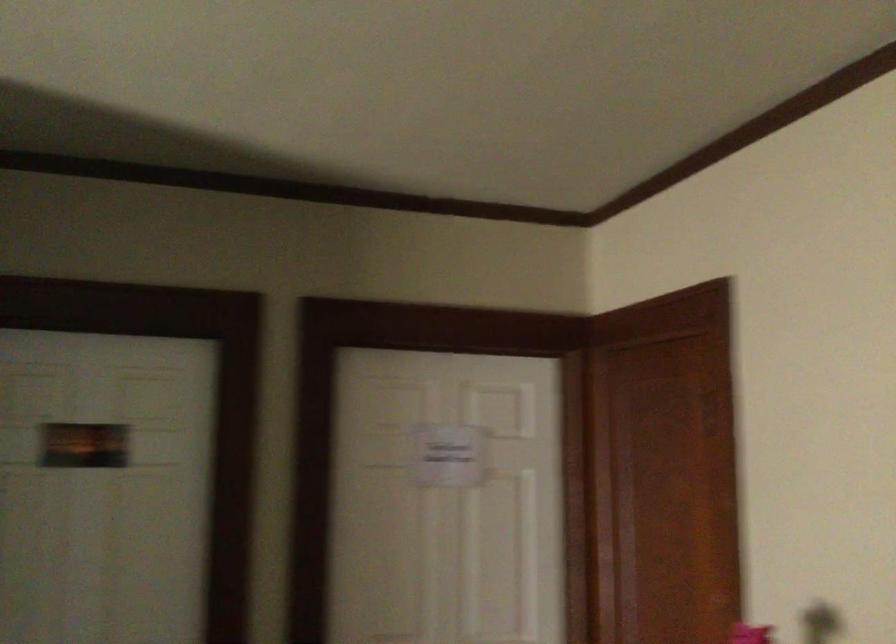
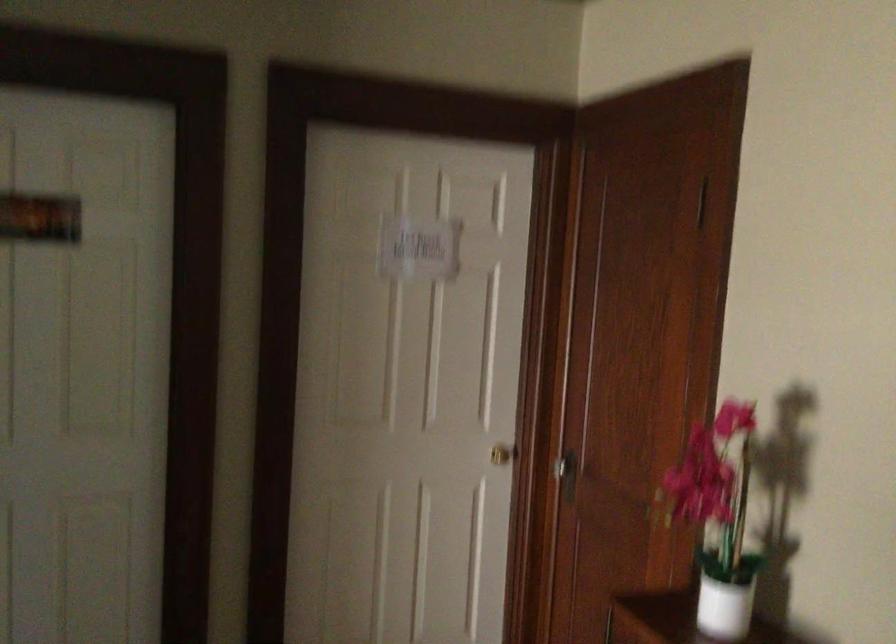
Question: The images are taken continuously from a first-person perspective. In which direction is your viewpoint rotating?

Choices:
 (A) Left
 (B) Right
 (C) Up
 (D) Down

Answer: (D)